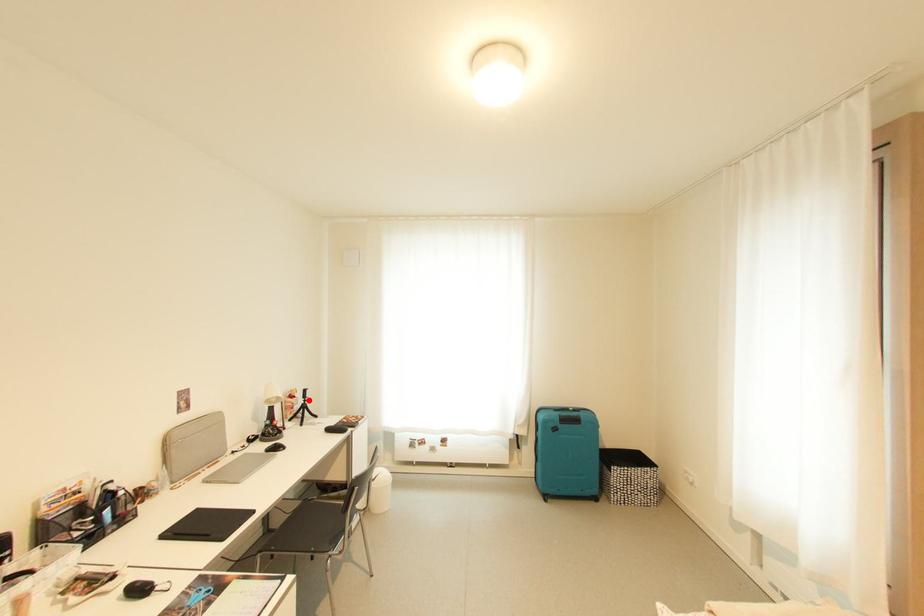
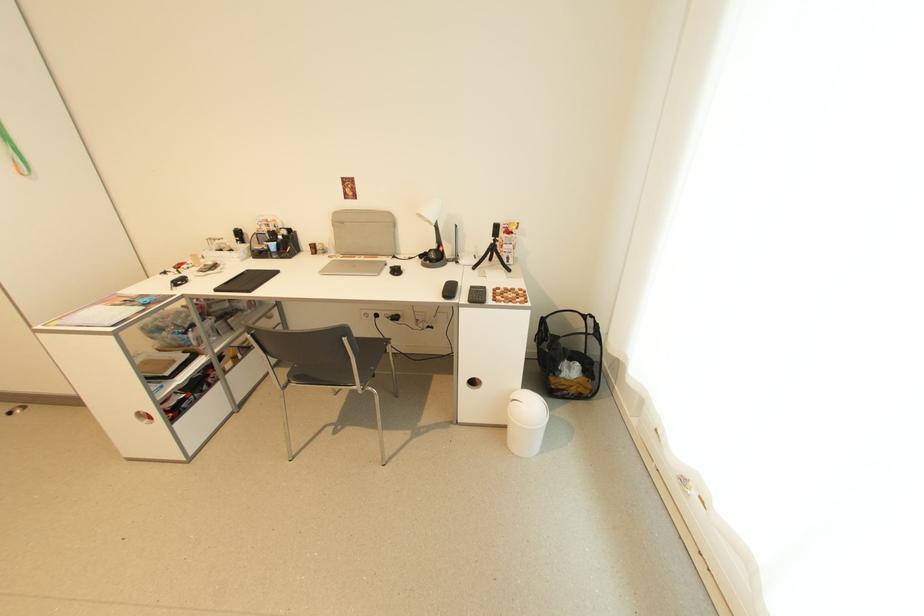
In the second image, find the point that corresponds to the highlighted location in the first image.

(497, 238)